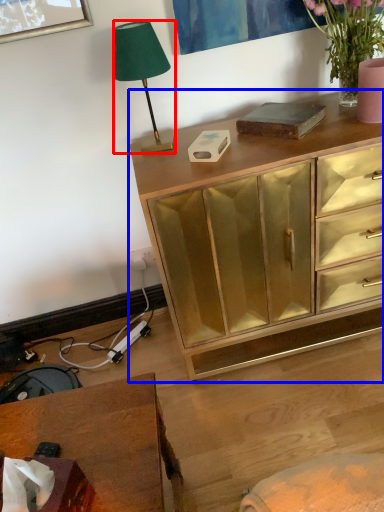
Question: Which of the following is the farthest to the observer, lamp (highlighted by a red box) or chest of drawers (highlighted by a blue box)?

Choices:
 (A) lamp
 (B) chest of drawers

Answer: (A)